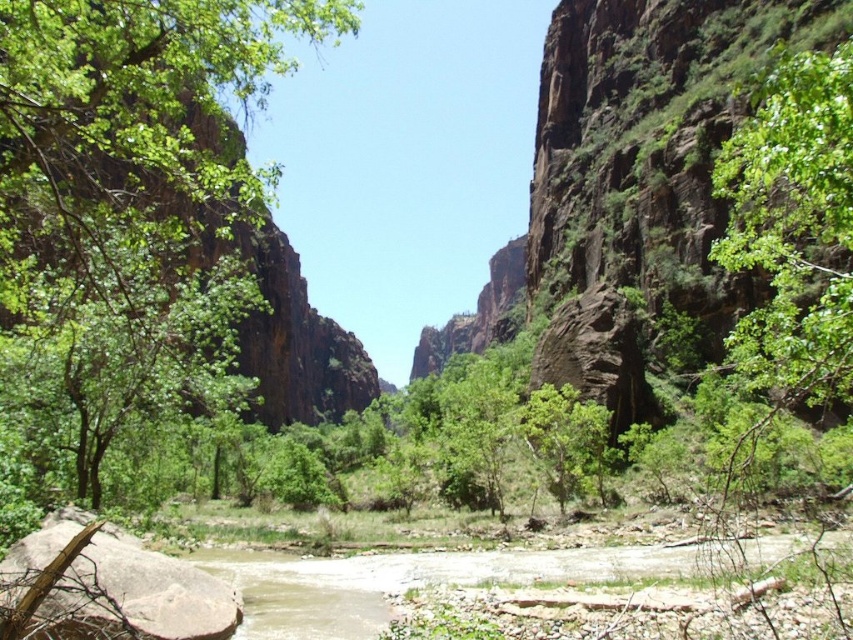
Does green leafy tree at upper right have a lesser height compared to green leafy tree at center?

No, green leafy tree at upper right is not shorter than green leafy tree at center.

Between point (758, 193) and point (569, 484), which one is positioned behind?

The point (569, 484) is behind.

Where is `green leafy tree at upper right`? green leafy tree at upper right is located at coordinates (793, 227).

Can you confirm if green leafy tree at upper right is positioned above brown rough rock at lower left?

Yes.

Between green leafy tree at upper right and brown rough rock at lower left, which one has less height?

brown rough rock at lower left is shorter.

Locate an element on the screen. The height and width of the screenshot is (640, 853). green leafy tree at upper right is located at coordinates (793, 227).

Who is more distant from viewer, (24, 83) or (762, 122)?

Point (24, 83)

This screenshot has width=853, height=640. Describe the element at coordinates (128, 141) in the screenshot. I see `green leafy tree at left` at that location.

You are a GUI agent. You are given a task and a screenshot of the screen. Output one action in this format:
    pyautogui.click(x=<x>, y=<y>)
    Task: Click on the green leafy tree at left
    
    Given the screenshot: What is the action you would take?
    pyautogui.click(x=128, y=141)

The image size is (853, 640). In order to click on green leafy tree at left in this screenshot , I will do `click(128, 141)`.